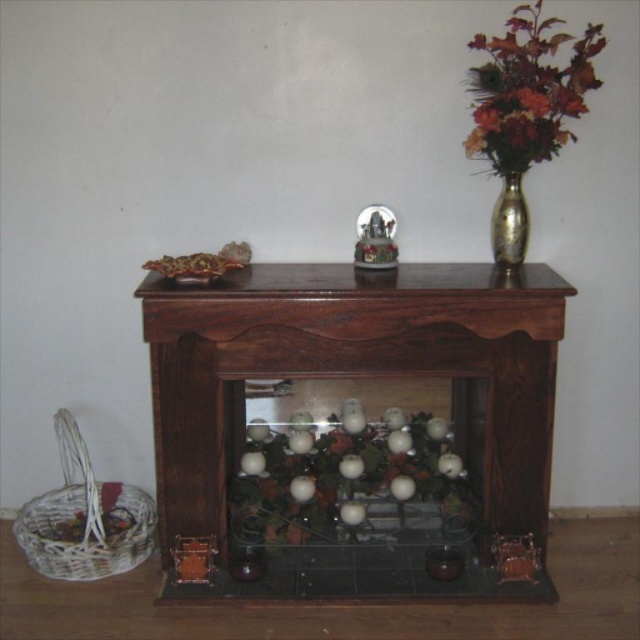
You are a delivery person who needs to place a new decorative item between the dark wood fireplace at center and the gold metallic vase at upper right. The item is 18 inches long. Will it fit in the space between them?

The dark wood fireplace at center and gold metallic vase at upper right are 21.16 inches apart from each other. Since the item is 18 inches long, it will fit in the space between them because 18 inches is shorter than 21.16 inches.

What is located at the coordinates point (340, 474) in the image?

The white matte floral arrangement at center is located at point (340, 474).

You are arranging items on the top shelf of the display cabinet. You need to place a new decorative item between the dark wood fireplace at center and the gold metallic vase at upper right. Where should you place it to ensure it is between them?

The dark wood fireplace at center is located below the gold metallic vase at upper right, so placing the new decorative item between them would require positioning it between the dark wood fireplace at center and the gold metallic vase at upper right along the vertical axis.